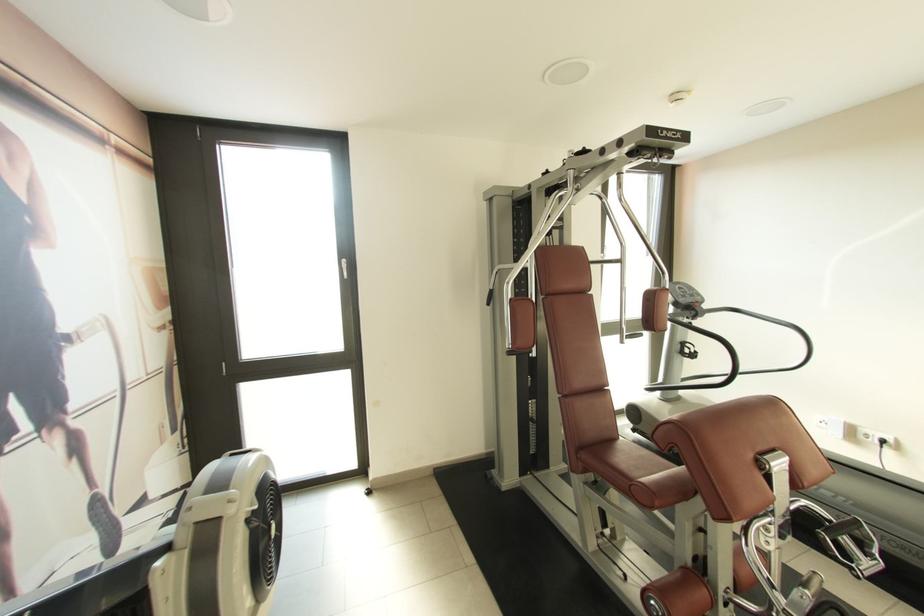
This screenshot has height=616, width=924. I want to click on brown leather pad, so click(x=748, y=438).